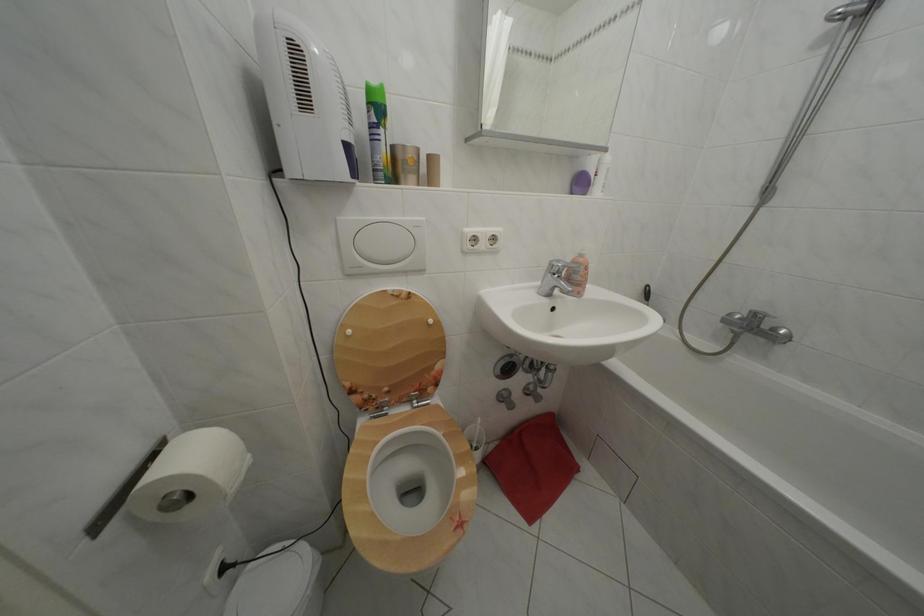
The image size is (924, 616). What do you see at coordinates (568, 265) in the screenshot? I see `the sink faucet handle` at bounding box center [568, 265].